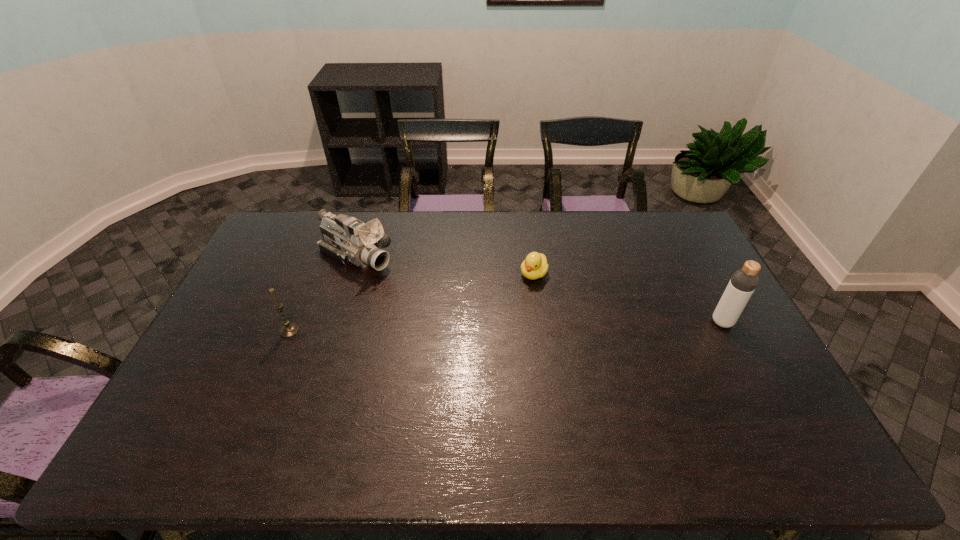
Where is `candle`? candle is located at coordinates (288, 330).

You are a GUI agent. You are given a task and a screenshot of the screen. Output one action in this format:
    pyautogui.click(x=<x>, y=<y>)
    Task: Click on the tallest object
    Image resolution: width=960 pixels, height=540 pixels.
    Given the screenshot: What is the action you would take?
    pyautogui.click(x=744, y=281)

Identify the location of bottle. (744, 281).

Where is `the shortest object`? Image resolution: width=960 pixels, height=540 pixels. the shortest object is located at coordinates 535,266.

At what (x,y) coordinates should I click in order to perform the action: click on the third object from left to right. Please return your answer as a coordinate pair (x, y). The image size is (960, 540). Looking at the image, I should click on (535, 266).

Identify the location of camcorder. (348, 240).

You are a GUI agent. You are given a task and a screenshot of the screen. Output one action in this format:
    pyautogui.click(x=<x>, y=<y>)
    Task: Click on the vacant region located 0.180m on the right of the candle
    
    Given the screenshot: What is the action you would take?
    pyautogui.click(x=358, y=331)

Locate an element on the screen. The image size is (960, 540). free space located 0.310m on the left of the rightmost object is located at coordinates (610, 322).

This screenshot has height=540, width=960. I want to click on vacant space located on the beak of the duckling, so click(x=466, y=366).

At what (x,y) coordinates should I click in order to perform the action: click on free region located 0.150m on the beak of the duckling. Please return your answer as a coordinate pair (x, y). Looking at the image, I should click on (506, 312).